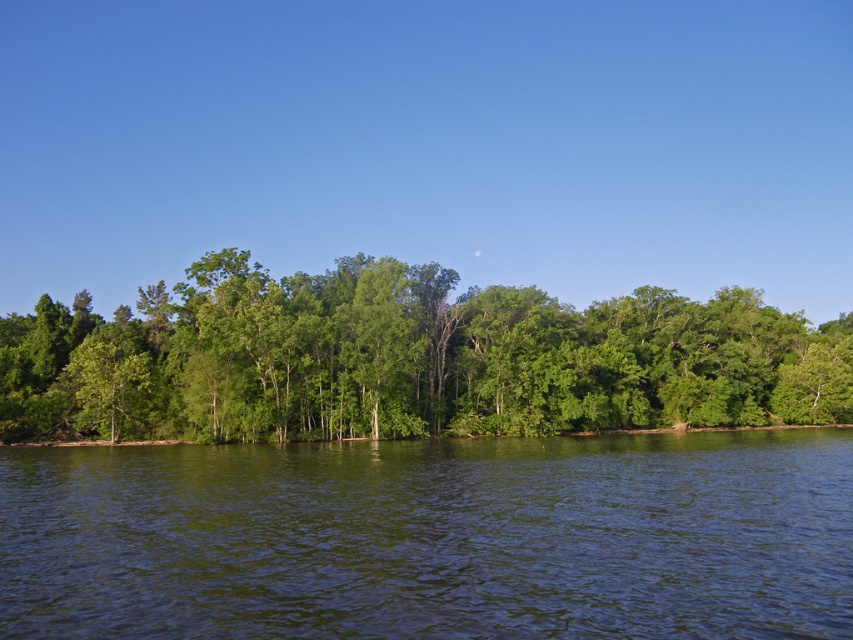
Does point (790, 608) come farther from viewer compared to point (646, 300)?

No, (790, 608) is in front of (646, 300).

Locate an element on the screen. This screenshot has height=640, width=853. green reflective water at center is located at coordinates (432, 538).